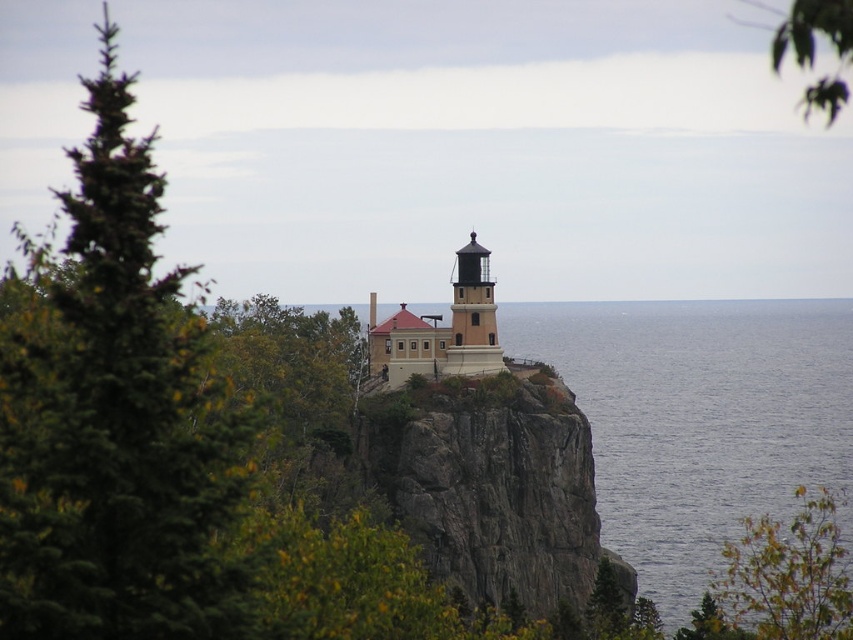
You are a bird flying over the cliff. You see the green leafy tree at lower right and the matte black lighthouse at center. Which object is positioned more to the east if the lighthouse is facing north?

The green leafy tree at lower right is positioned more to the east because it is to the right of the matte black lighthouse at center, which is facing north. Since the lighthouse faces north, its right side would be eastward direction.

You are standing at the base of the cliff near the water and looking up at the lighthouse. There are two points marked on the cliff face. The first point is at coordinates point (x=770, y=604) and the second point is at point (x=460, y=364). Which point is closer to you as you look up?

Point (x=770, y=604) is in front of point (x=460, y=364), so it is closer to you as you look up at the cliff face.